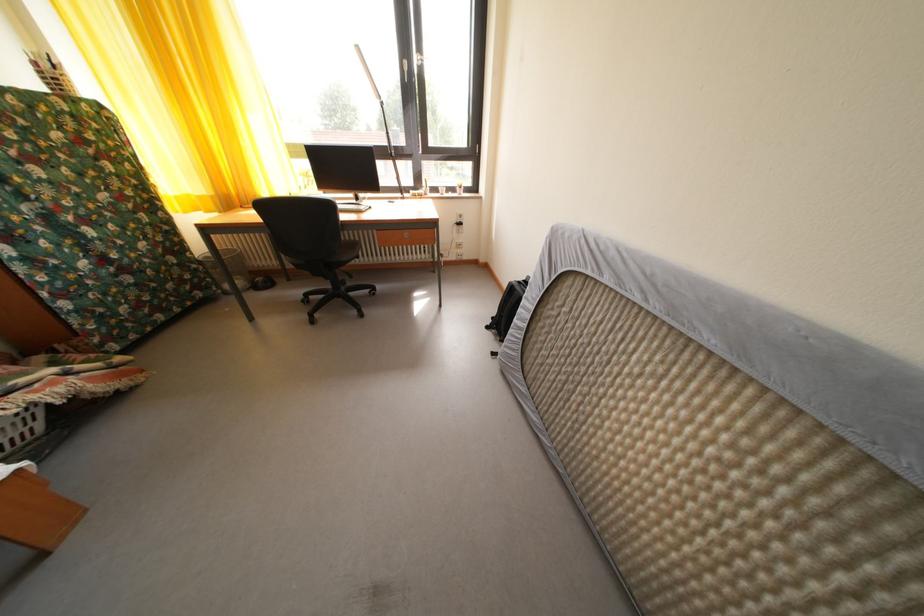
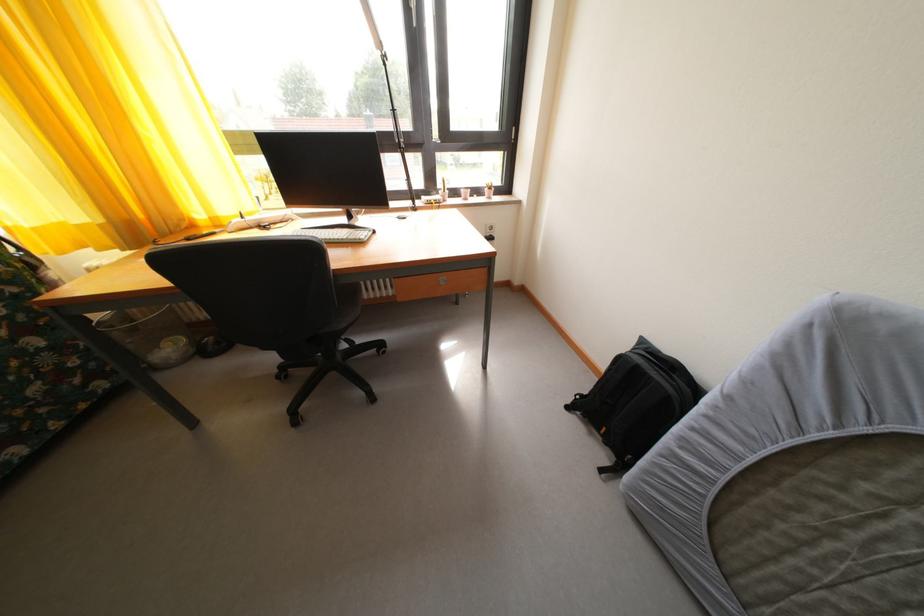
The images are taken continuously from a first-person perspective. In which direction are you moving?

The movement direction of the cameraman is left, forward.